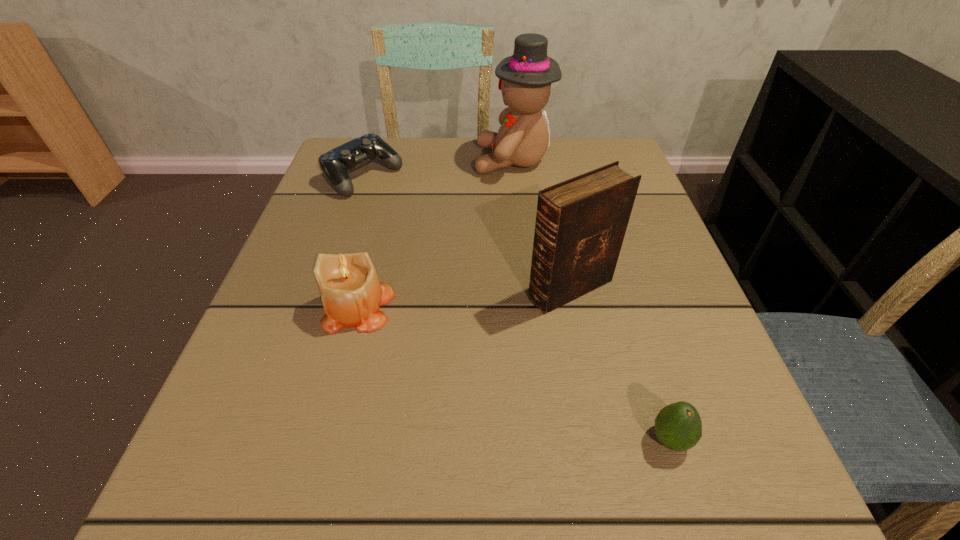
This screenshot has width=960, height=540. Identify the location of object at the near right corner. (678, 426).

Locate an element on the screen. This screenshot has height=540, width=960. free space at the far edge is located at coordinates (548, 154).

Locate an element on the screen. The width and height of the screenshot is (960, 540). vacant space at the near edge is located at coordinates (440, 529).

At what (x,y) coordinates should I click in order to perform the action: click on free space at the left edge. Please return your answer as a coordinate pair (x, y). Looking at the image, I should click on (300, 242).

Locate an element on the screen. free space at the right edge is located at coordinates (717, 443).

Identify the location of vacant space at the far left corner of the desktop. The height and width of the screenshot is (540, 960). (349, 177).

Where is `free space at the far right corner`? The image size is (960, 540). free space at the far right corner is located at coordinates (603, 140).

This screenshot has width=960, height=540. Identify the location of free space between the third shortest object and the nearest object. (515, 373).

At what (x,y) coordinates should I click in order to perform the action: click on free space between the candle and the Bible. Please return your answer as a coordinate pair (x, y). The height and width of the screenshot is (540, 960). Looking at the image, I should click on (465, 298).

What are the coordinates of `vacant area between the nearest object and the third shortest object` in the screenshot? It's located at (515, 373).